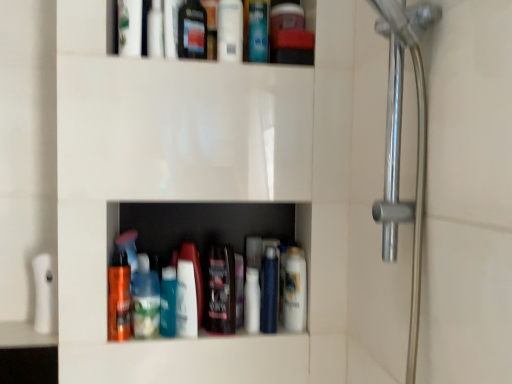
Question: Would you say transparent plastic bottle at upper center, the 2th toiletry ordered from the bottom, is to the left or to the right of silver metallic shower handle at right in the picture?

Choices:
 (A) left
 (B) right

Answer: (A)

Question: In terms of size, does transparent plastic bottle at upper center, which is the second toiletry from right to left, appear bigger or smaller than silver metallic shower handle at right?

Choices:
 (A) big
 (B) small

Answer: (B)

Question: Estimate the real-world distances between objects in this image. Which object is farther from the transparent plastic bottle at upper center, arranged as the 1th toiletry when viewed from the top?

Choices:
 (A) white glossy mouthwash at center, the first mouthwash in the right-to-left sequence
 (B) shiny black bottle at center, placed as the fifth mouthwash when sorted from right to left
 (C) translucent plastic bottles at center
 (D) white glossy lotion at center, acting as the second toiletry starting from the left
 (E) shiny orange bottle at lower center, which ranks as the 8th mouthwash in right-to-left order

Answer: (A)

Question: Based on their relative distances, which object is farther from the transparent plastic bottle at upper center, the 2th toiletry ordered from the bottom?

Choices:
 (A) shiny orange bottle at lower center, which ranks as the 8th mouthwash in right-to-left order
 (B) white glossy mouthwash at upper center, the fourth mouthwash in the right-to-left sequence
 (C) silver metallic shower handle at right
 (D) glossy plastic mouthwash at upper center, which appears as the sixth mouthwash when viewed from the right
 (E) translucent plastic bottle at center

Answer: (C)